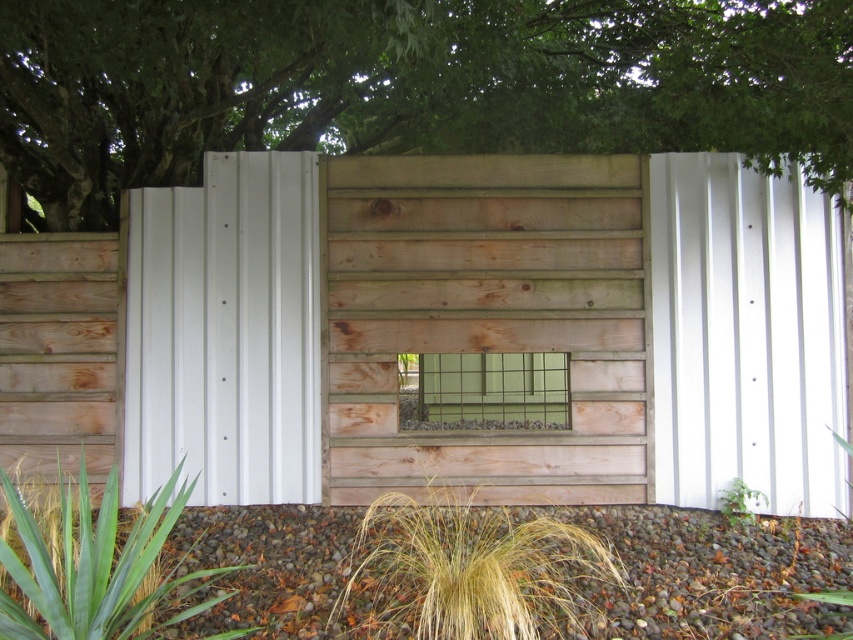
You are standing in front of the wall and notice a green leafy tree at upper center and golden grass at center. Which object is positioned more to the left side?

The green leafy tree at upper center is positioned more to the left side than the golden grass at center.

You are standing in front of the wall and want to touch both the green leafy tree at upper center and the green leafy grass at lower left. Which one can you reach first without moving your position?

You can reach the green leafy tree at upper center first because it is closer to you than the green leafy grass at lower left, which is further away.